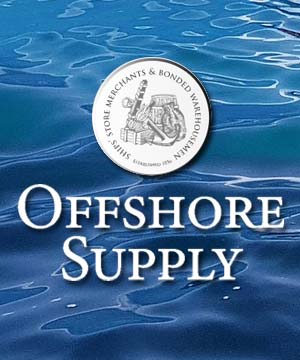
Where is `picture`? Image resolution: width=300 pixels, height=360 pixels. picture is located at coordinates 157,113.